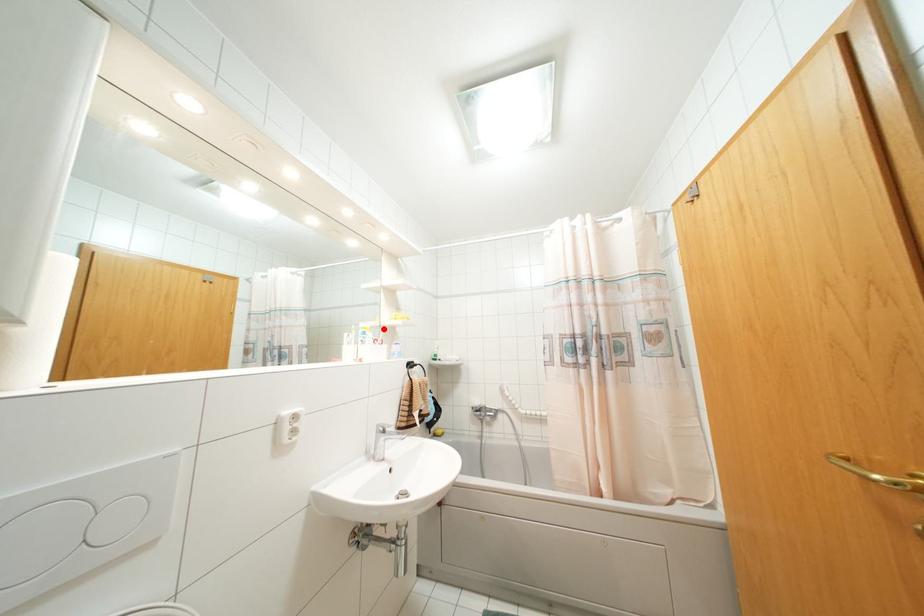
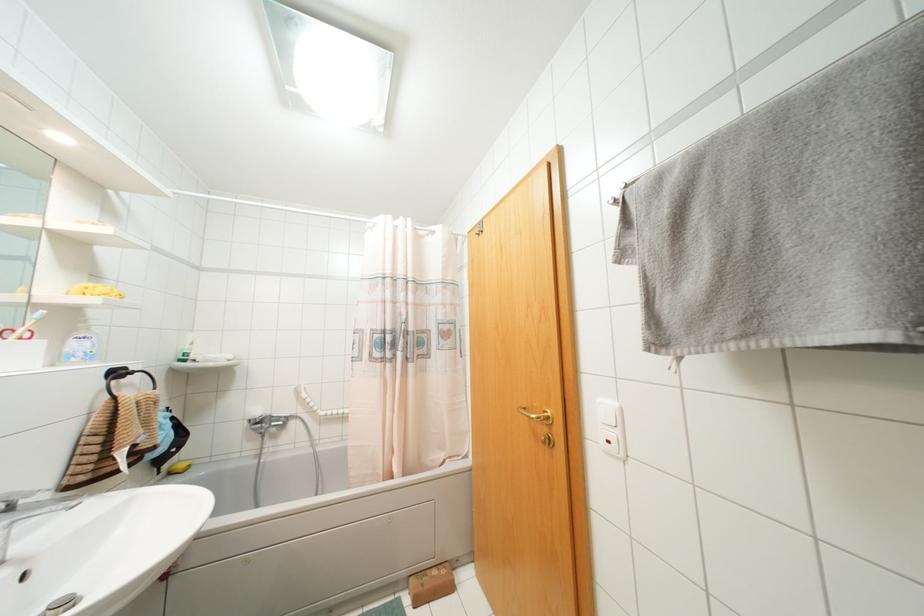
The point at the highlighted location is marked in the first image. Where is the corresponding point in the second image?

(42, 310)